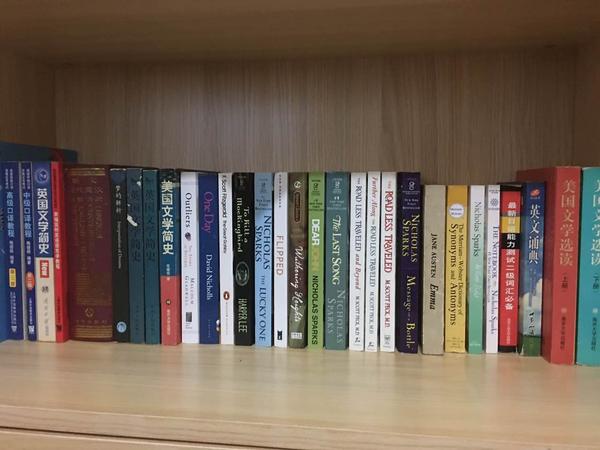
I want to click on books with white spines, so click(45, 303), click(181, 305), click(228, 308), click(282, 317), click(352, 326), click(367, 334), click(385, 338), click(490, 337).